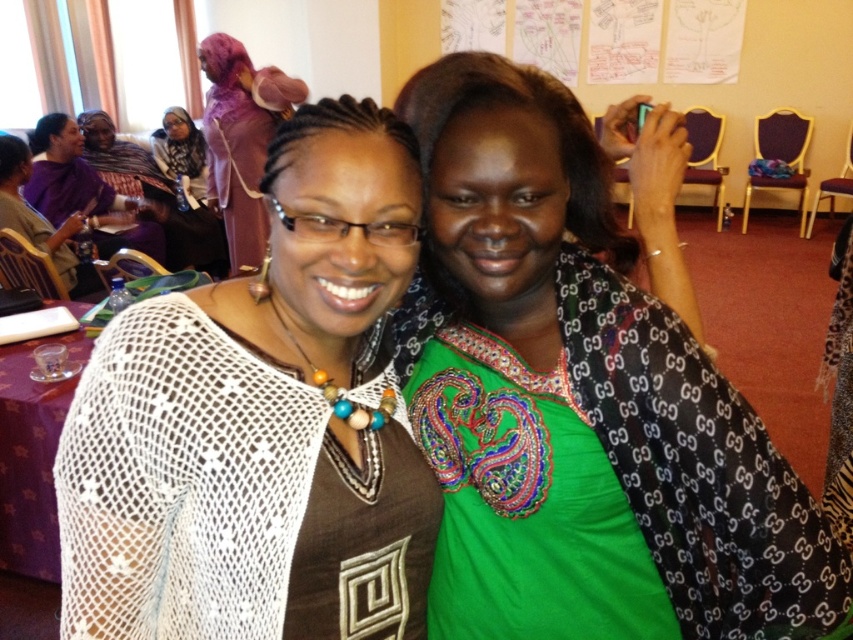
Does point (230, 154) lie behind point (62, 262)?

Yes, it is behind point (62, 262).

In the scene shown: Between purple satin hijab at upper left and purple fabric at left, which one appears on the left side from the viewer's perspective?

purple fabric at left

At what (x,y) coordinates should I click in order to perform the action: click on purple satin hijab at upper left. Please return your answer as a coordinate pair (x, y). This screenshot has width=853, height=640. Looking at the image, I should click on (241, 138).

Is matte black hijab at upper left smaller than purple fabric at left?

No.

You are a GUI agent. You are given a task and a screenshot of the screen. Output one action in this format:
    pyautogui.click(x=<x>, y=<y>)
    Task: Click on the matte black hijab at upper left
    This screenshot has width=853, height=640.
    Given the screenshot: What is the action you would take?
    pyautogui.click(x=189, y=196)

This screenshot has height=640, width=853. What do you see at coordinates (189, 196) in the screenshot? I see `matte black hijab at upper left` at bounding box center [189, 196].

Find the location of a particular element. matte black hijab at upper left is located at coordinates (189, 196).

Identify the location of green embroidered blouse at center. The height and width of the screenshot is (640, 853). (579, 401).

Can you confirm if green embroidered blouse at center is shorter than matte black hijab at upper left?

Yes, green embroidered blouse at center is shorter than matte black hijab at upper left.

Who is more distant from viewer, (538,506) or (202,240)?

The point (202,240) is more distant.

Identify the location of green embroidered blouse at center. Image resolution: width=853 pixels, height=640 pixels. (579, 401).